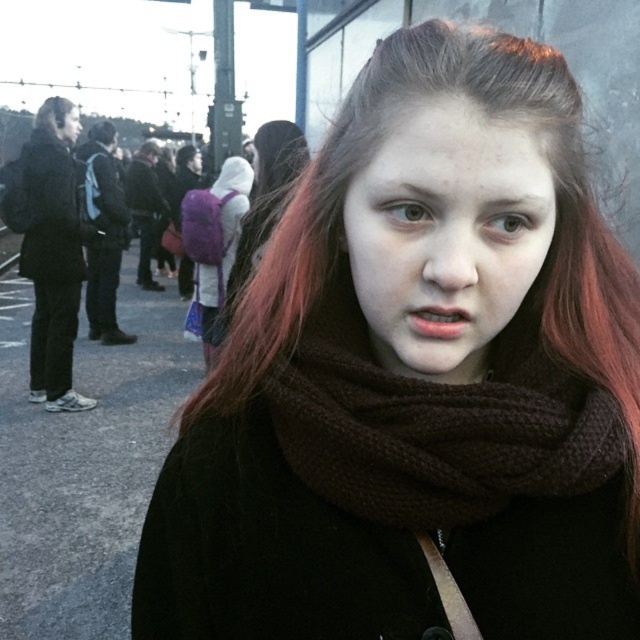
You are a photographer trying to capture a candid shot of the person wearing the matte black jacket at left and the individual with brown woolen hair at upper left. Given that your camera has a minimum focus distance of 20 inches, will you be able to focus on both subjects simultaneously?

The matte black jacket at left and brown woolen hair at upper left are 19.96 inches apart from each other. Since the distance between them is less than the camera lens minimum focus distance of 20 inches, the camera might not be able to focus on both subjects simultaneously.

You are a tailor who needs to determine if the brown knitted scarf at center can be folded to fit into a pocket on the matte black jacket at left. Based on the provided scene, can the scarf fit into the jacket pocket?

The brown knitted scarf at center is narrower than the matte black jacket at left, so it can likely be folded to fit into the jacket pocket.

You are a photographer trying to capture a candid shot of the person wearing the matte black jacket at left and the matte black backpack at left. Since you want to focus on both items clearly, which one should you adjust your camera focus on first?

The matte black jacket at left is closer to the viewer than the matte black backpack at left, so you should focus on the matte black jacket at left first to ensure both are in focus.